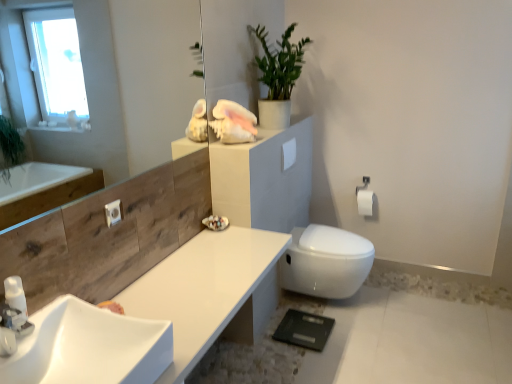
This screenshot has height=384, width=512. In order to click on vacant point above white glossy counter top at center (from a real-world perspective) in this screenshot , I will do `click(201, 275)`.